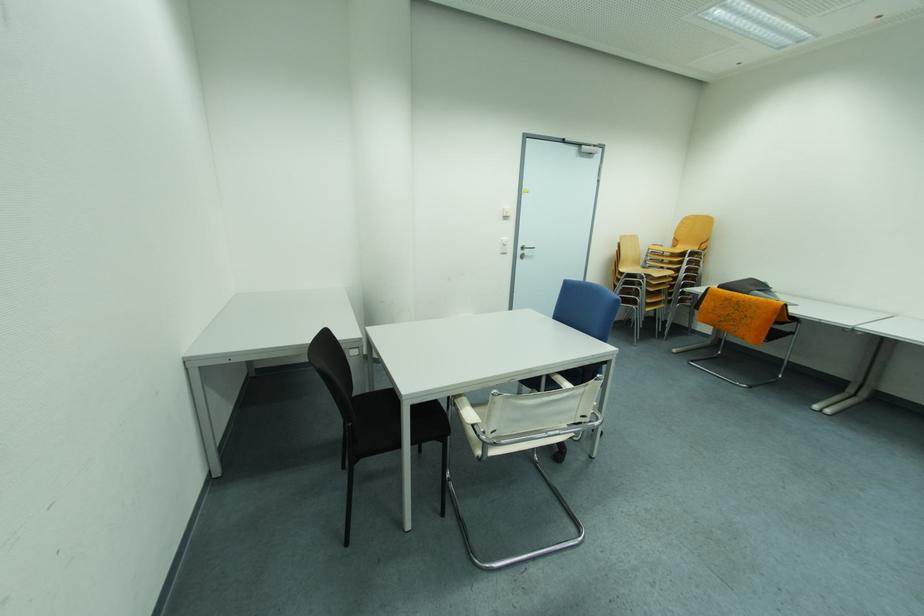
The image size is (924, 616). What do you see at coordinates (481, 407) in the screenshot?
I see `the white chair sitting surface` at bounding box center [481, 407].